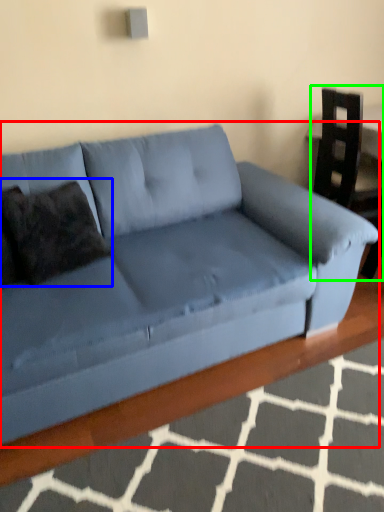
Question: Which object is positioned farthest from studio couch (highlighted by a red box)? Select from pillow (highlighted by a blue box) and armchair (highlighted by a green box).

Choices:
 (A) pillow
 (B) armchair

Answer: (B)